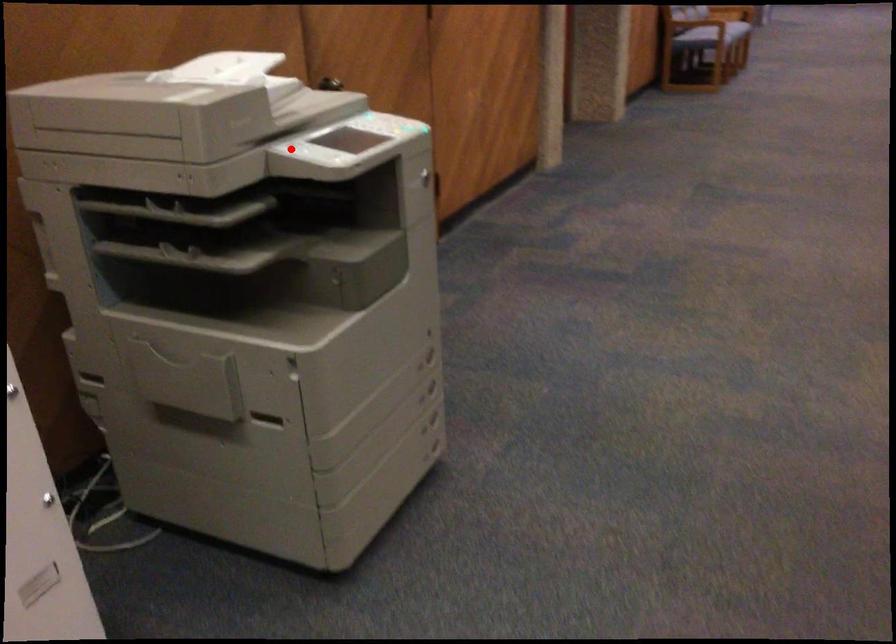
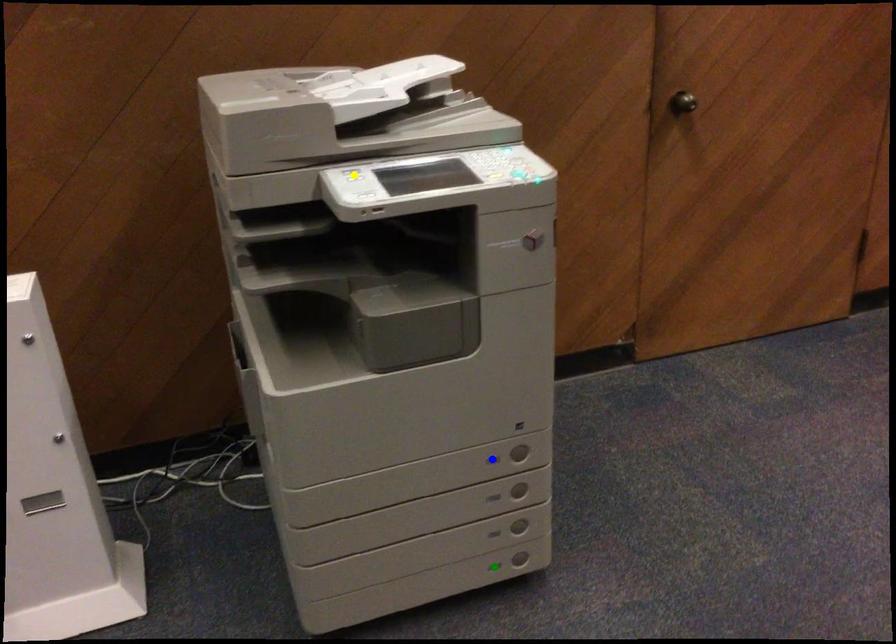
Question: I am providing you with two images of the same scene from different viewpoints. A red point is marked on the first image. You are given multiple points on the second image. Which spot in image 2 lines up with the point in image 1?

Choices:
 (A) blue point
 (B) green point
 (C) yellow point

Answer: (C)